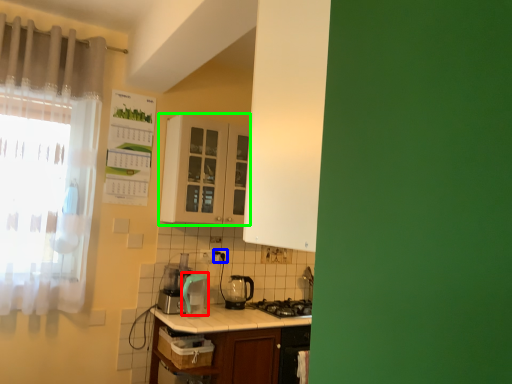
Question: Which object is the farthest from appliance (highlighted by a red box)? Choose among these: electric outlet (highlighted by a blue box) or cabinetry (highlighted by a green box).

Choices:
 (A) electric outlet
 (B) cabinetry

Answer: (B)